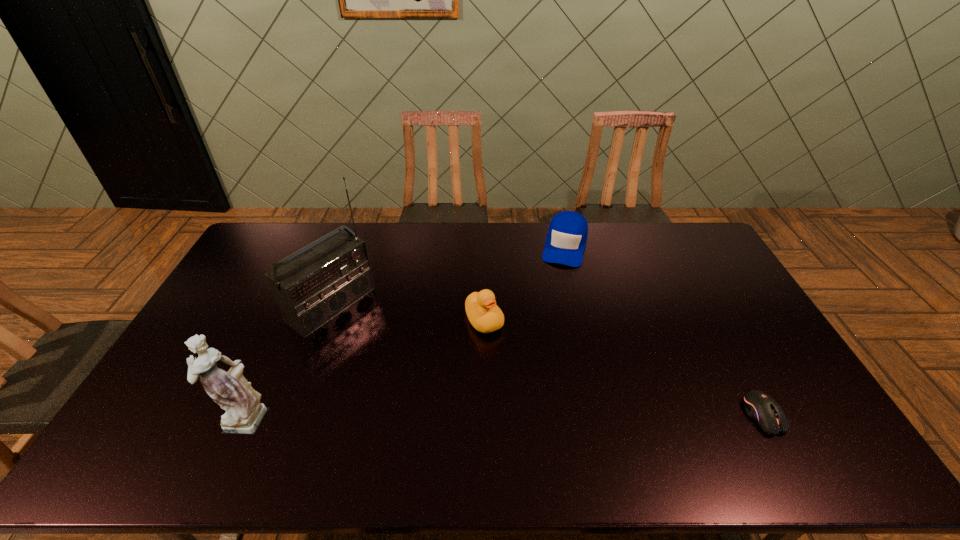
Find the location of a particular element. free space between the radio receiver and the figurine is located at coordinates (287, 360).

Where is `object that is the third closest one to the fourth object from left to right`? This screenshot has height=540, width=960. object that is the third closest one to the fourth object from left to right is located at coordinates (763, 409).

This screenshot has width=960, height=540. Identify the location of object that is the closest one to the figurine. (311, 288).

Image resolution: width=960 pixels, height=540 pixels. Find the location of `free space in the image that satisfies the following two spatial constraints: 1. on the back side of the third tallest object; 2. on the right side of the baseball cap`. free space in the image that satisfies the following two spatial constraints: 1. on the back side of the third tallest object; 2. on the right side of the baseball cap is located at coordinates (484, 246).